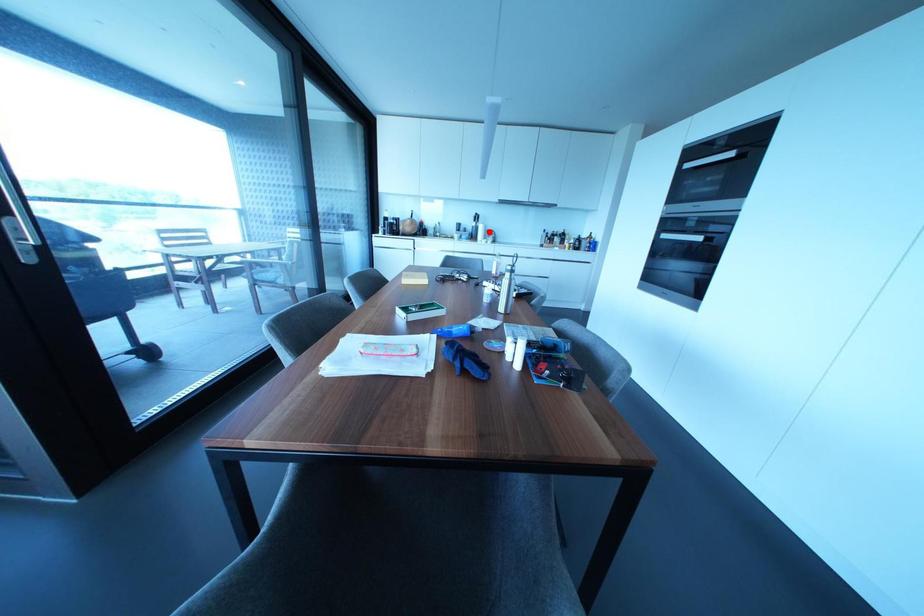
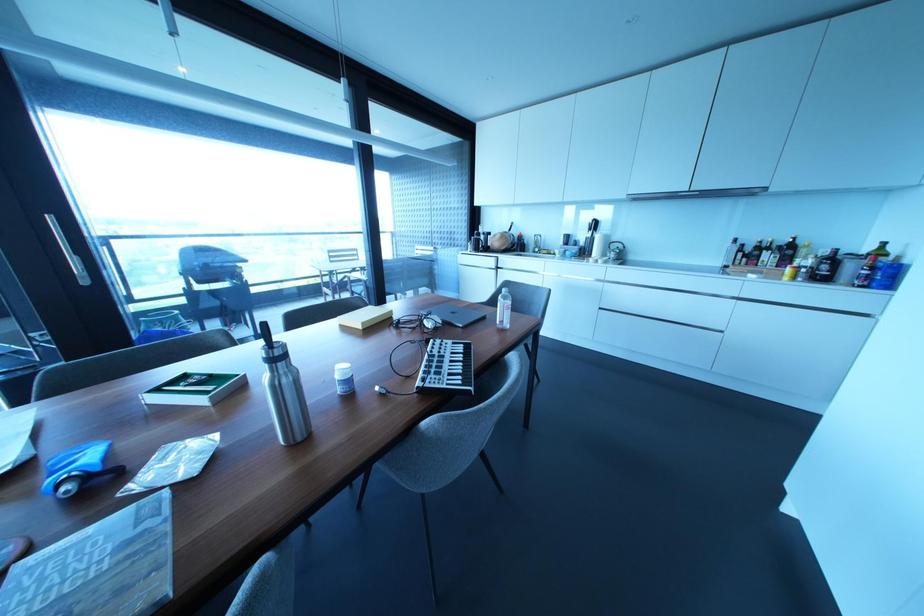
Find the pixel in the second image that matches the highlighted location in the first image.

(614, 245)